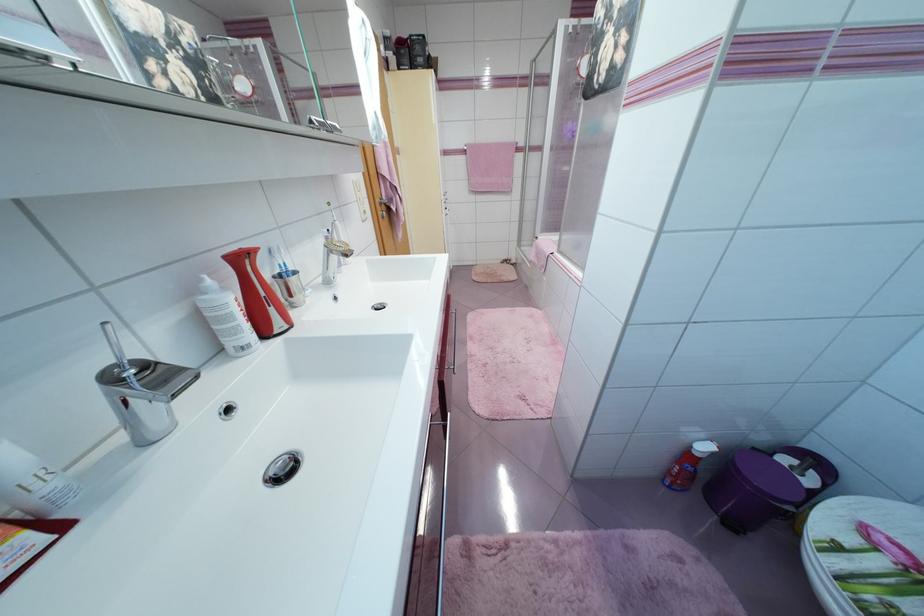
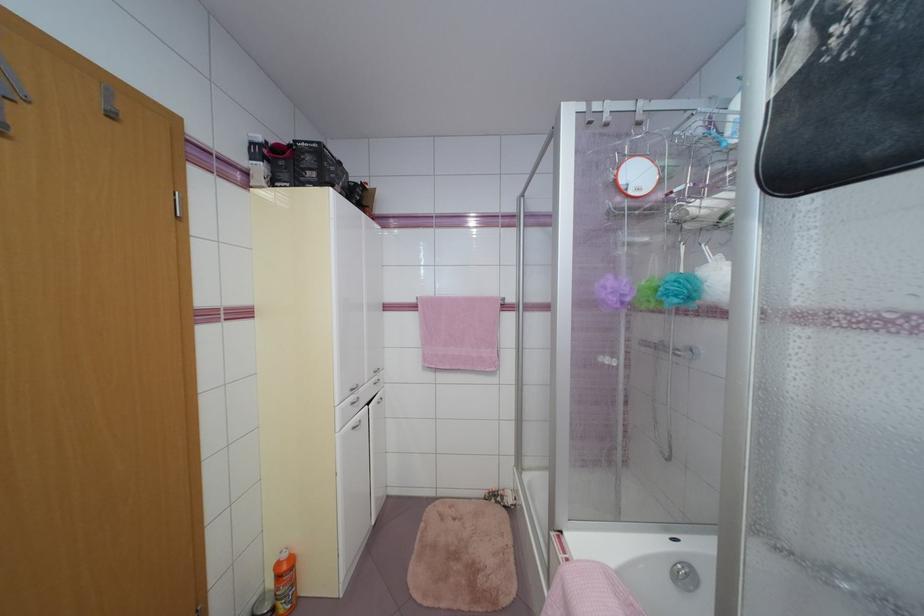
Question: What movement of the cameraman would produce the second image?

Choices:
 (A) Left
 (B) Right
 (C) Forward
 (D) Backward

Answer: (C)